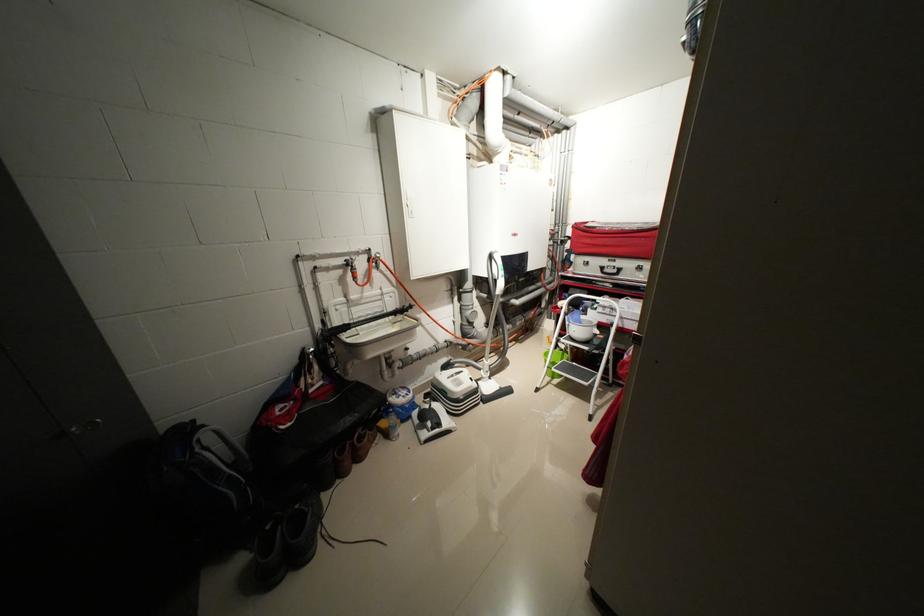
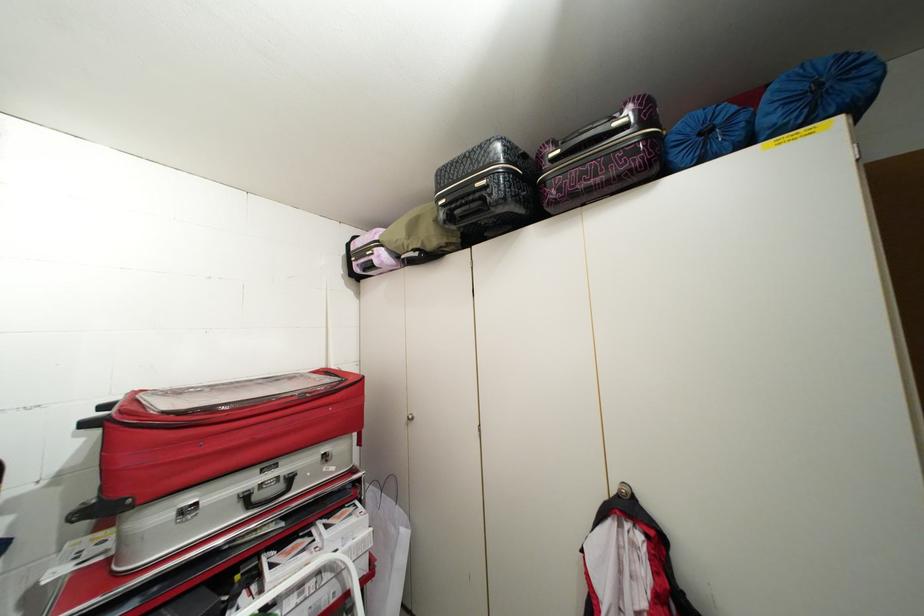
Find the pixel in the second image that matches (623,272) in the first image.

(287, 487)